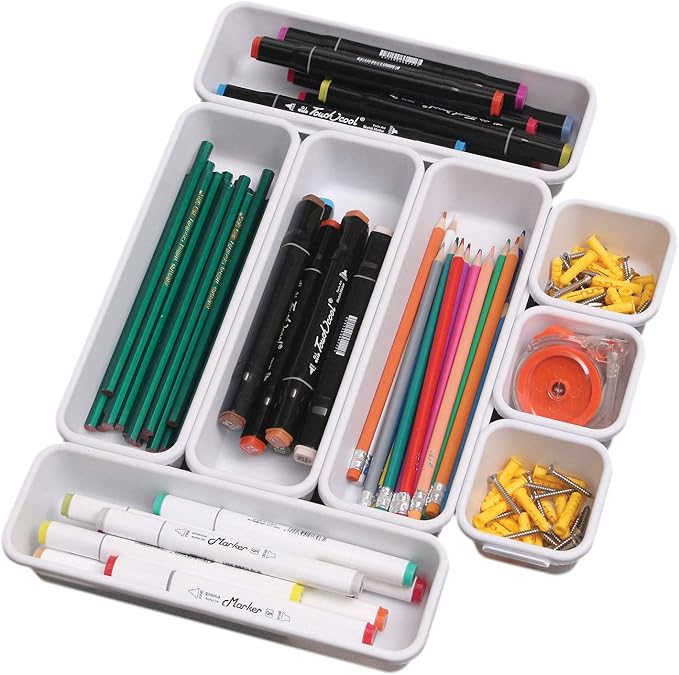
You are a GUI agent. You are given a task and a screenshot of the screen. Output one action in this format:
    pyautogui.click(x=<x>, y=<y>)
    Task: Click on the white bins
    The width and height of the screenshot is (679, 675).
    Given the screenshot: What is the action you would take?
    pyautogui.click(x=417, y=634), pyautogui.click(x=286, y=460), pyautogui.click(x=333, y=487), pyautogui.click(x=170, y=456), pyautogui.click(x=238, y=67), pyautogui.click(x=595, y=213), pyautogui.click(x=619, y=429), pyautogui.click(x=529, y=448)